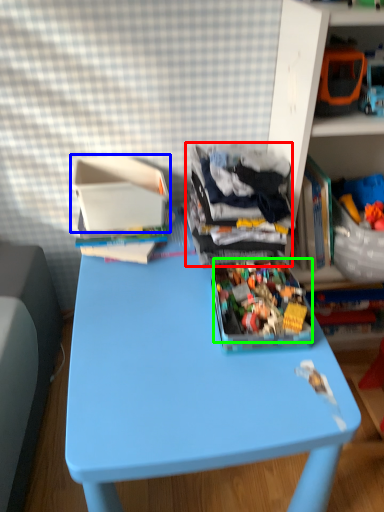
Question: Which object is the closest to the clothing (highlighted by a red box)? Choose among these: cardboard box (highlighted by a blue box) or toy (highlighted by a green box).

Choices:
 (A) cardboard box
 (B) toy

Answer: (B)